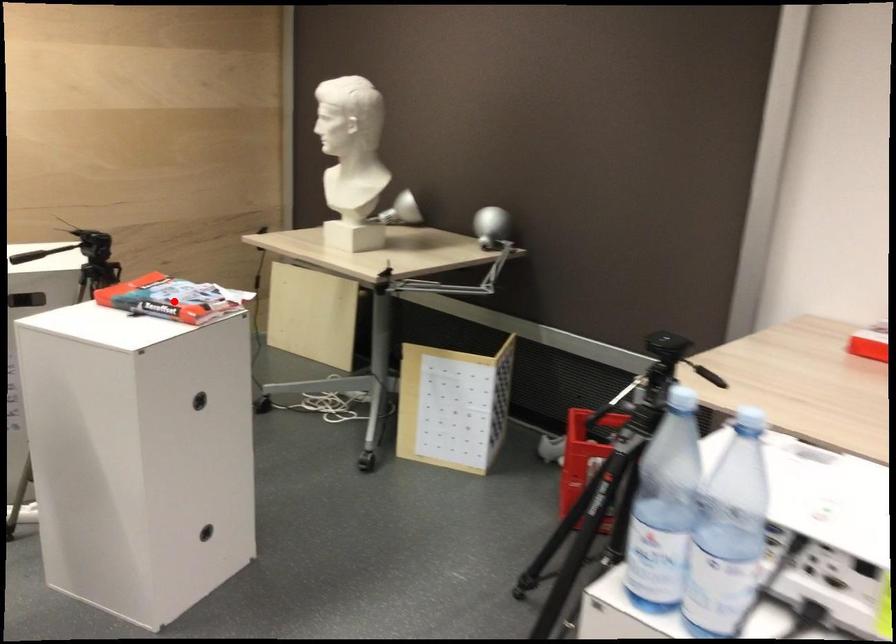
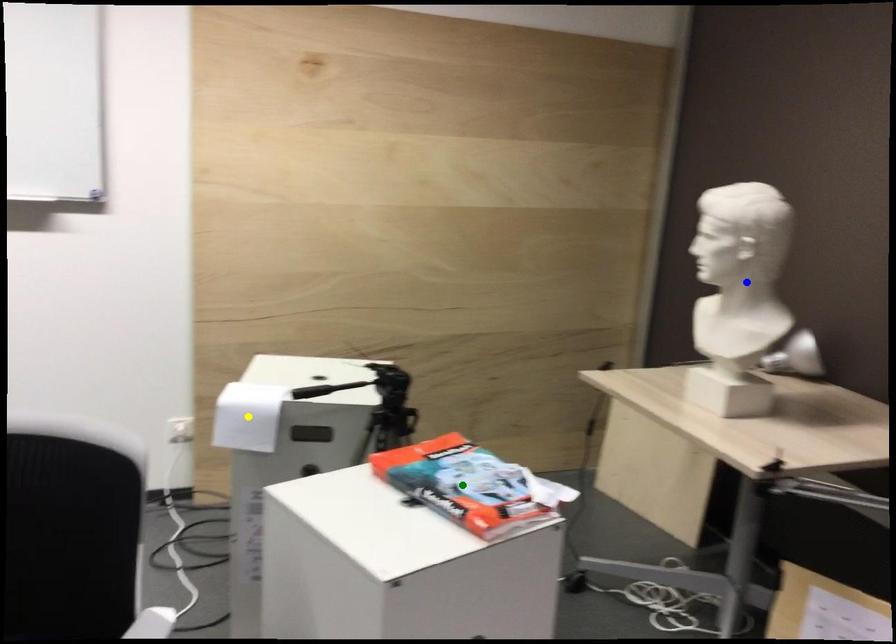
Question: I am providing you with two images of the same scene from different viewpoints. A red point is marked on the first image. You are given multiple points on the second image. Which spot in image 2 lines up with the point in image 1?

Choices:
 (A) blue point
 (B) yellow point
 (C) green point

Answer: (C)